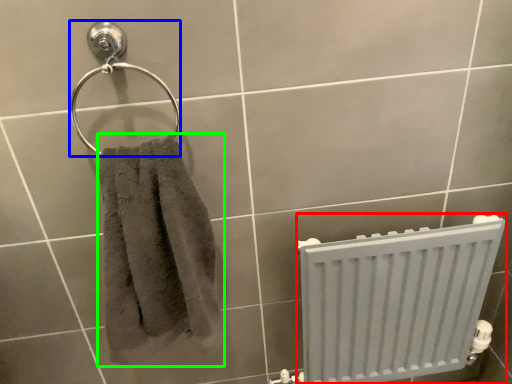
Question: Considering the real-world distances, which object is closest to radiator (highlighted by a red box)? towel bar (highlighted by a blue box) or towel (highlighted by a green box).

Choices:
 (A) towel bar
 (B) towel

Answer: (B)